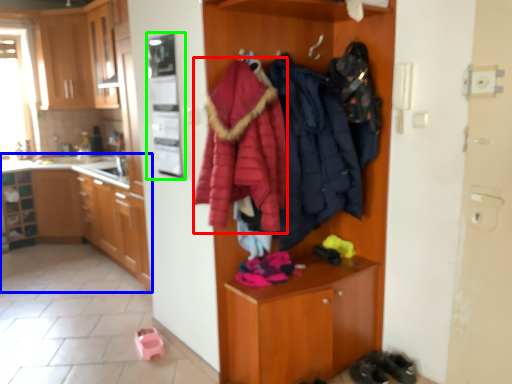
Question: Which object is positioned closest to bathrobe (highlighted by a red box)? Select from cabinetry (highlighted by a blue box) and appliance (highlighted by a green box).

Choices:
 (A) cabinetry
 (B) appliance

Answer: (B)